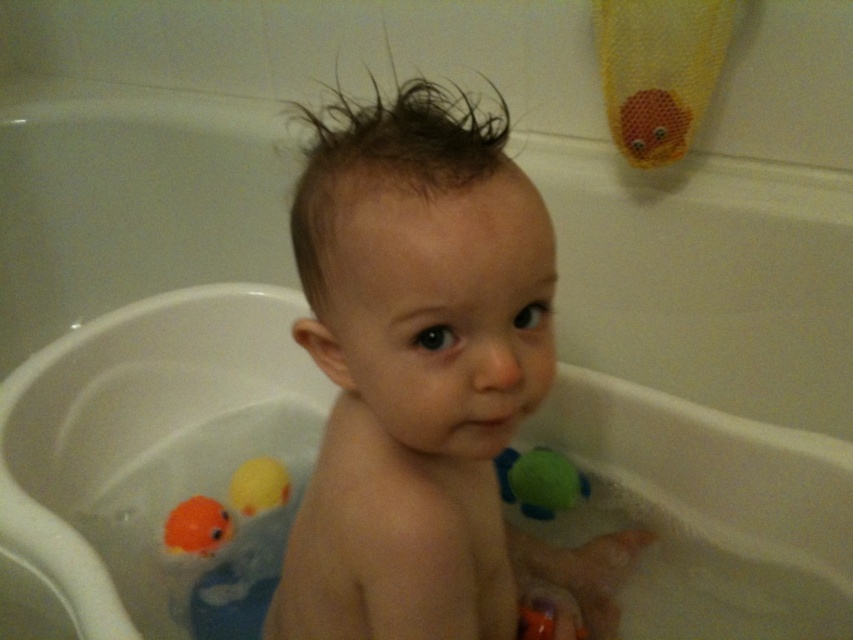
Question: Based on their relative distances, which object is farther from the green rubber ball at right?

Choices:
 (A) yellow rubber duck at lower left
 (B) smooth skin baby at center

Answer: (B)

Question: Can you confirm if green rubber ball at right is smaller than yellow rubber duck at lower left?

Choices:
 (A) yes
 (B) no

Answer: (B)

Question: Which of these objects is positioned closest to the yellow rubber duck at lower left?

Choices:
 (A) orange rubber duck at lower left
 (B) smooth skin baby at center

Answer: (A)

Question: Is green rubber ball at right wider than orange rubber duck at lower left?

Choices:
 (A) no
 (B) yes

Answer: (B)

Question: Which of the following is the closest to the observer?

Choices:
 (A) green rubber ball at right
 (B) smooth skin baby at center

Answer: (B)

Question: Does smooth skin baby at center have a smaller size compared to yellow rubber duck at lower left?

Choices:
 (A) no
 (B) yes

Answer: (A)